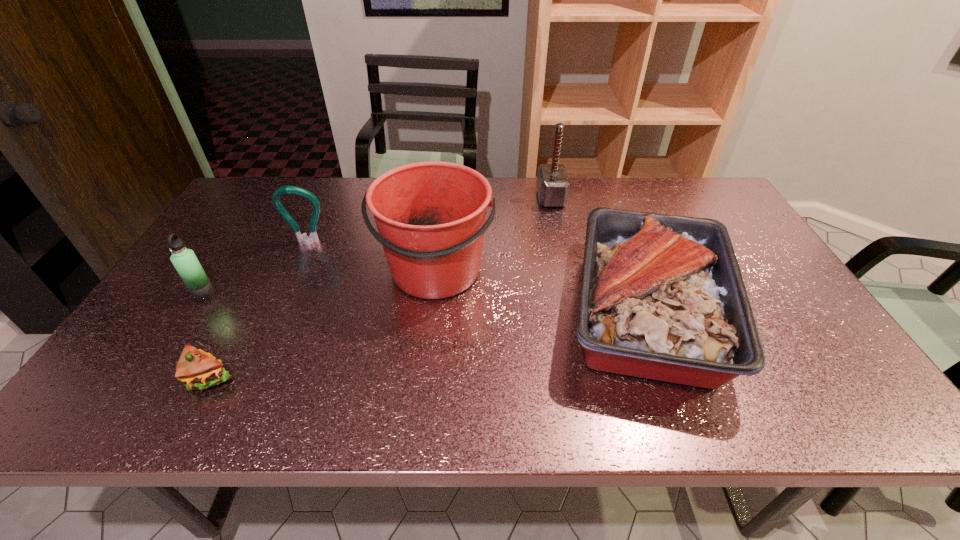
Where is `free space at the left edge of the desktop`? This screenshot has height=540, width=960. free space at the left edge of the desktop is located at coordinates (128, 363).

In the image, there is a desktop. In order to click on vacant space at the right edge in this screenshot , I will do `click(742, 232)`.

This screenshot has width=960, height=540. In the image, there is a desktop. Find the location of `free space at the near right corner`. free space at the near right corner is located at coordinates (870, 418).

The height and width of the screenshot is (540, 960). I want to click on free space between the shortest object and the thermos bottle, so click(207, 336).

The image size is (960, 540). What are the coordinates of `free space between the bottle opener and the second shortest object` in the screenshot? It's located at (478, 275).

Image resolution: width=960 pixels, height=540 pixels. In order to click on vacant area between the shortest object and the third object from right to left in this screenshot , I will do `click(323, 324)`.

Identify the location of vacant space that is in between the sandwich and the hammer. The width and height of the screenshot is (960, 540). click(380, 288).

The width and height of the screenshot is (960, 540). What are the coordinates of `vacant area that lies between the sandwich and the bottle opener` in the screenshot? It's located at (259, 310).

The width and height of the screenshot is (960, 540). What are the coordinates of `free spot between the shortest object and the leftmost object` in the screenshot? It's located at (207, 336).

Locate an element on the screen. The image size is (960, 540). object that is the fourth closest to the shortest object is located at coordinates (662, 297).